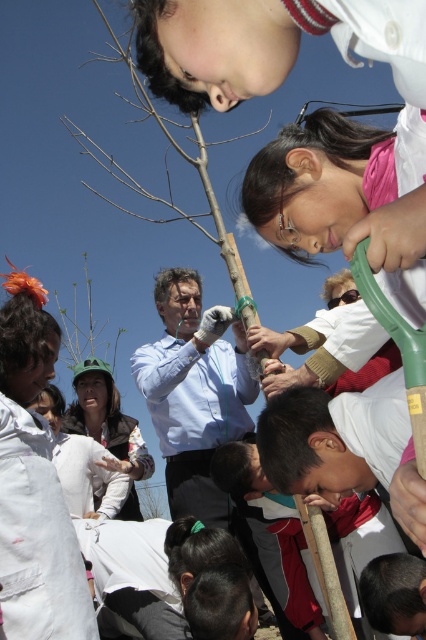
Is point (89, 636) in front of point (77, 371)?

Yes, point (89, 636) is closer to viewer.

Does white cotton shirt at lower left have a lesser height compared to white fabric shirt at center?

No.

This screenshot has height=640, width=426. What do you see at coordinates (34, 484) in the screenshot?
I see `white cotton shirt at lower left` at bounding box center [34, 484].

The image size is (426, 640). In order to click on white cotton shirt at lower left in this screenshot , I will do 34,484.

Does white cotton shirt at lower left have a lesser height compared to green leafy plant at center?

In fact, white cotton shirt at lower left may be taller than green leafy plant at center.

Which is in front, point (39, 320) or point (77, 340)?

Point (39, 320) is more forward.

Where is `white cotton shirt at lower left`? This screenshot has height=640, width=426. white cotton shirt at lower left is located at coordinates (34, 484).

Does bare wood tree at center have a smaller size compared to green leafy plant at center?

No, bare wood tree at center is not smaller than green leafy plant at center.

Does bare wood tree at center lie behind green leafy plant at center?

That is False.

Is point (204, 147) closer to camera compared to point (58, 301)?

Yes, point (204, 147) is closer to viewer.

The height and width of the screenshot is (640, 426). Identify the location of bare wood tree at center. (169, 192).